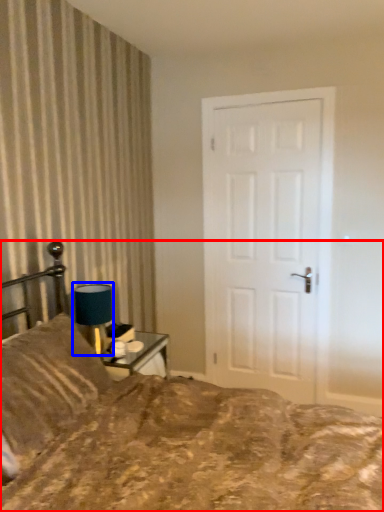
Question: Among these objects, which one is nearest to the camera, bed (highlighted by a red box) or table lamp (highlighted by a blue box)?

Choices:
 (A) bed
 (B) table lamp

Answer: (A)